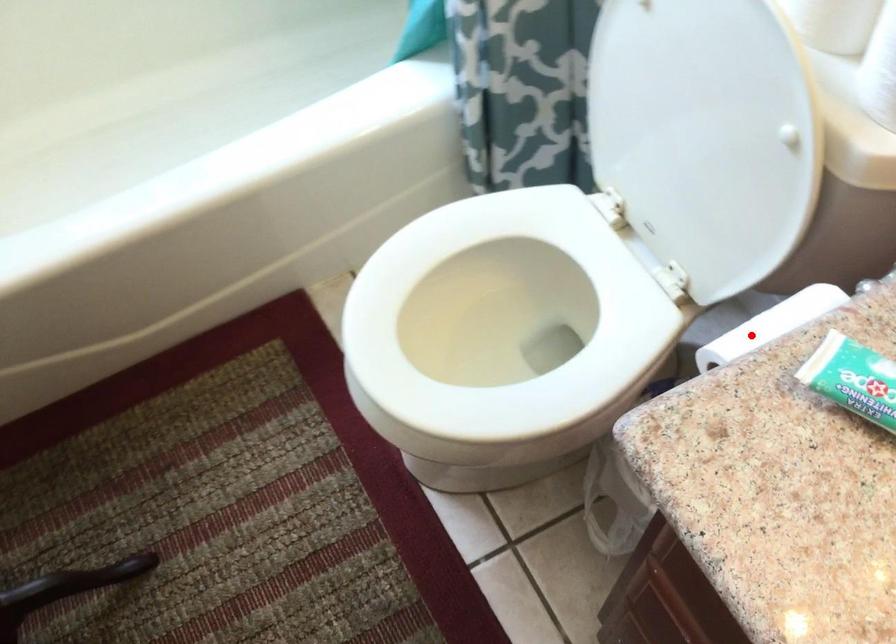
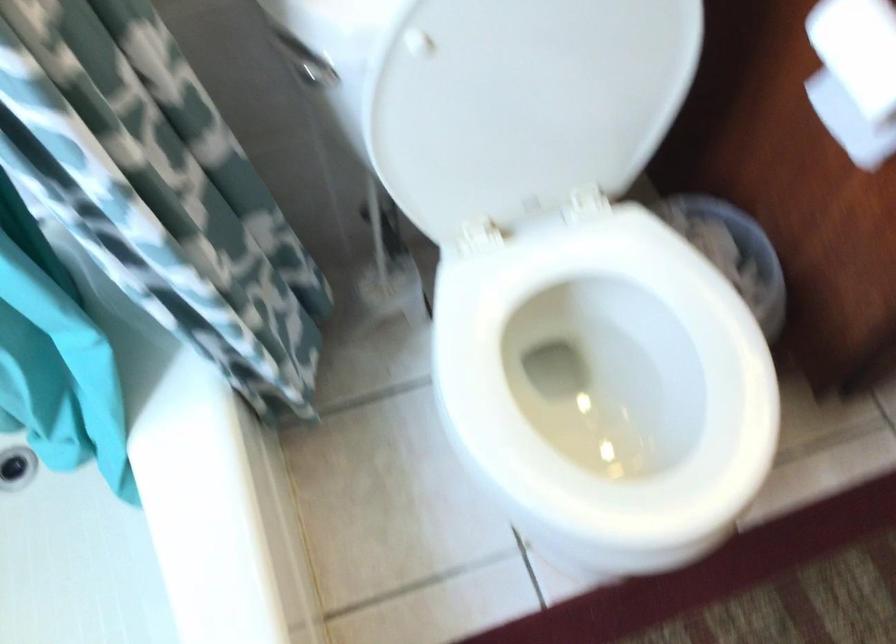
In the second image, find the point that corresponds to the highlighted location in the first image.

(855, 76)